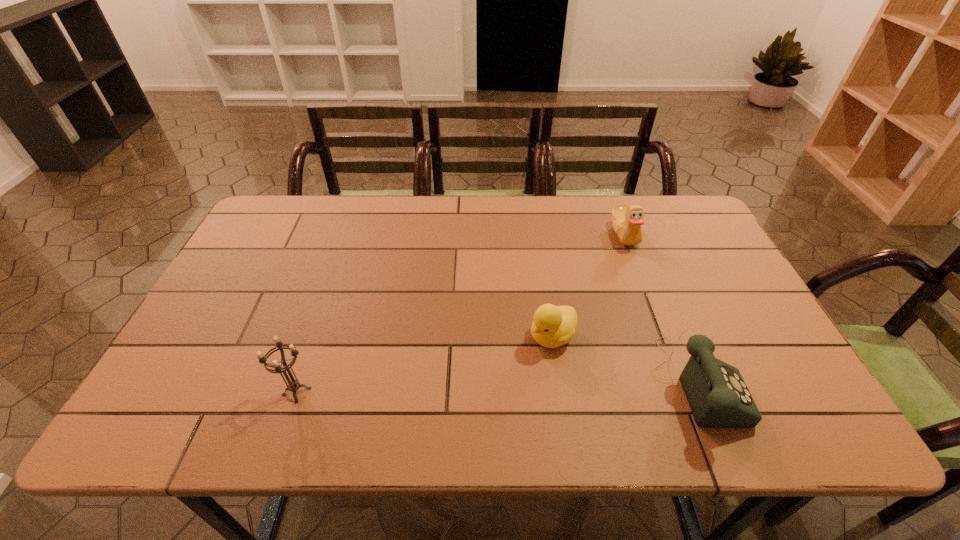
Identify the location of vacant space that satisfies the following two spatial constraints: 1. on the back side of the farthest object; 2. on the right side of the third object from right to left. (538, 234).